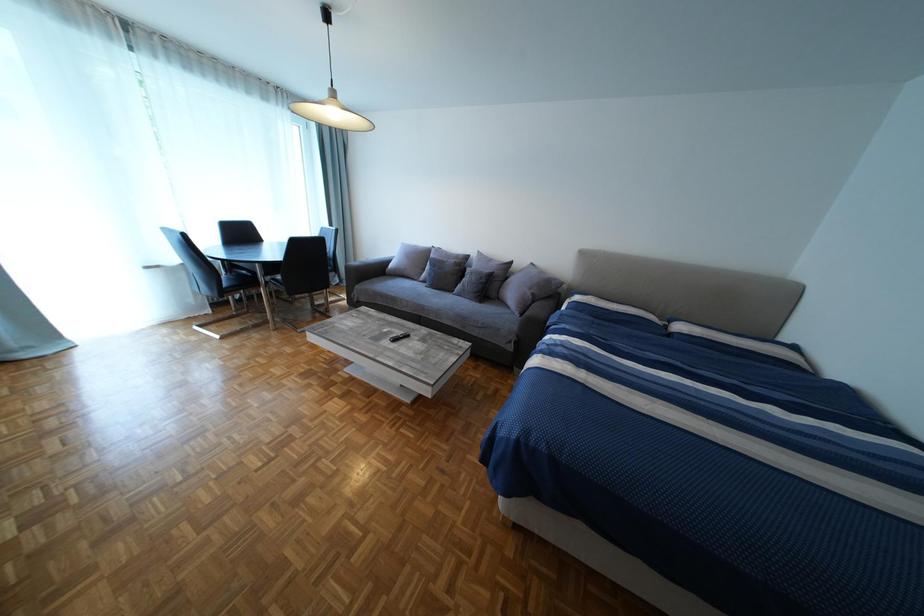
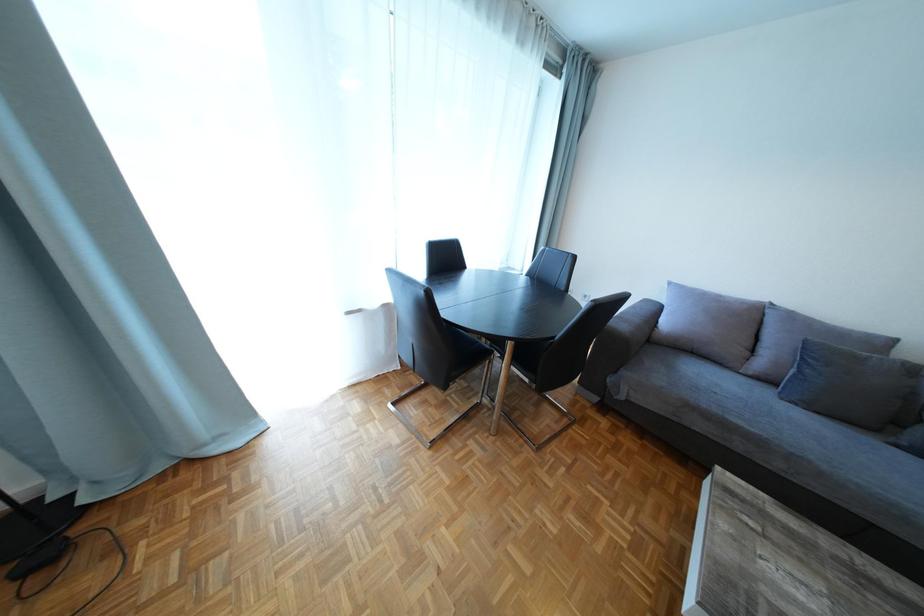
The images are taken continuously from a first-person perspective. In which direction are you moving?

The movement direction of the cameraman is left, forward.